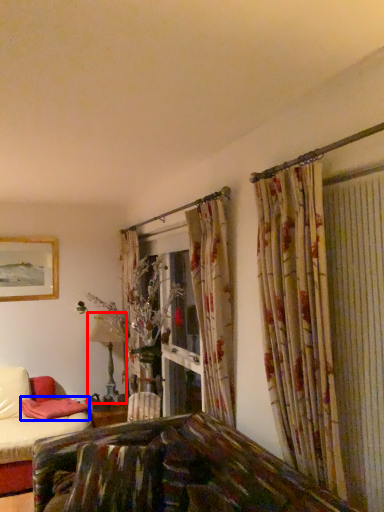
Question: Among these objects, which one is farthest to the camera, table lamp (highlighted by a red box) or pillow (highlighted by a blue box)?

Choices:
 (A) table lamp
 (B) pillow

Answer: (A)